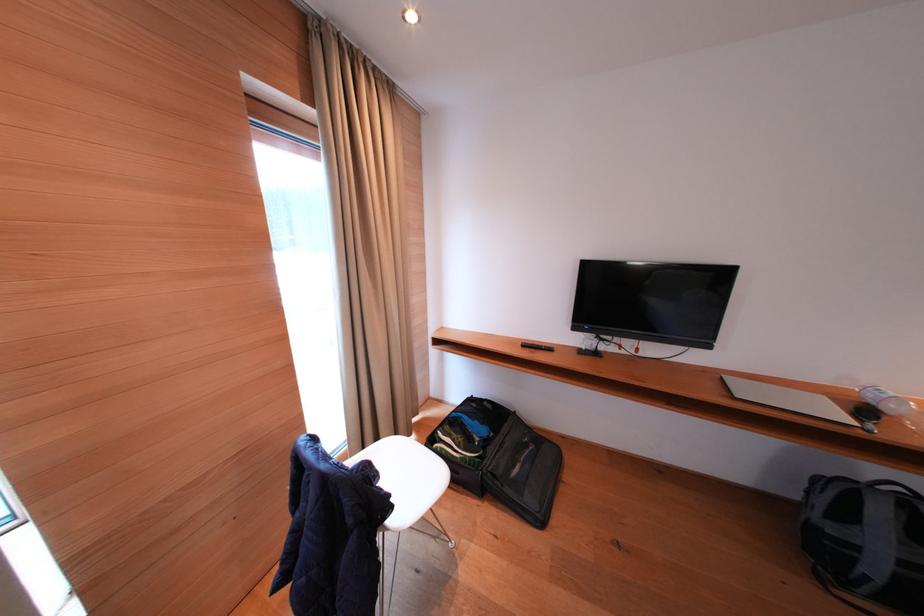
The width and height of the screenshot is (924, 616). Find the location of `black bag strap`. black bag strap is located at coordinates (891, 529).